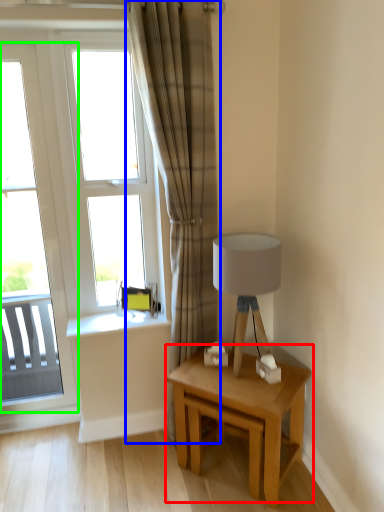
Question: Which is farther away from table (highlighted by a red box)? curtain (highlighted by a blue box) or window (highlighted by a green box)?

Choices:
 (A) curtain
 (B) window

Answer: (B)